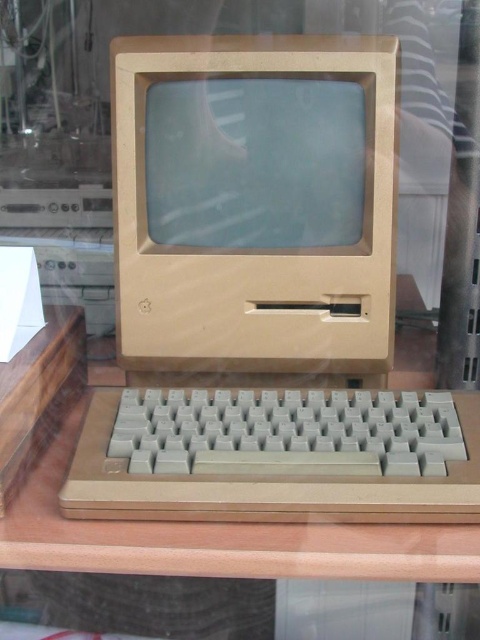
You are setting up a new desk arrangement and want to place a modern laptop between the beige plastic desktop computer at center and the wooden table at center. Based on their thickness, which object should the laptop be placed closer to?

The beige plastic desktop computer at center is thinner than the wooden table at center. Therefore, the laptop should be placed closer to the wooden table at center to maintain balance between the two objects.

You are a technician trying to install a new component between the beige plastic desktop computer at center and the wooden table at center. The component requires a minimum of 6 inches of space. Based on the image, can you fit the component between them?

The beige plastic desktop computer at center and wooden table at center are 5.71 inches apart, which is less than the required 6 inches. Therefore, the component cannot be installed between them.

You are setting up a new desk arrangement and need to place both the gray plastic keyboard at bottom and the wooden table at center. Given their sizes, which object should you place first to ensure proper positioning?

The gray plastic keyboard at bottom is smaller than the wooden table at center, so you should place the wooden table at center first to ensure there is enough space for both objects.